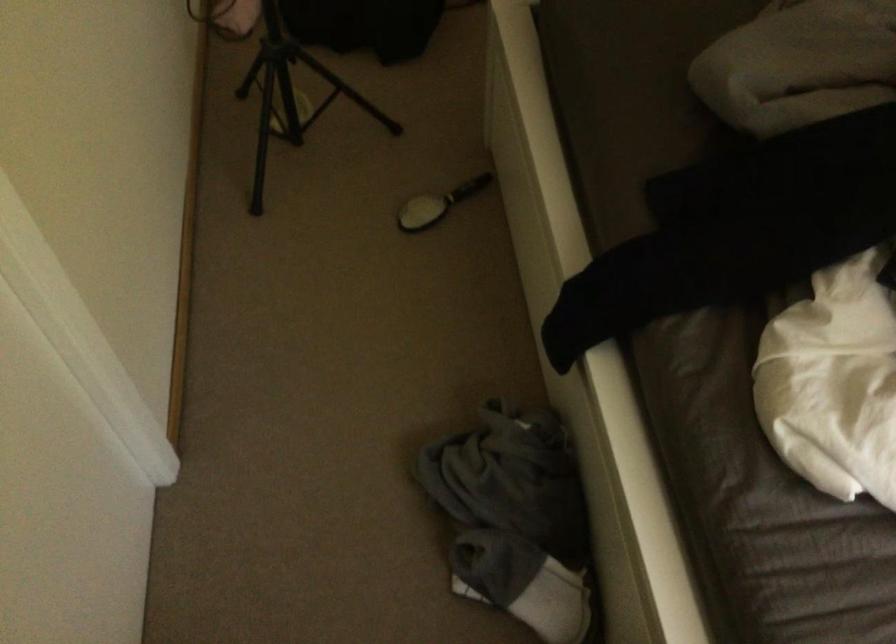
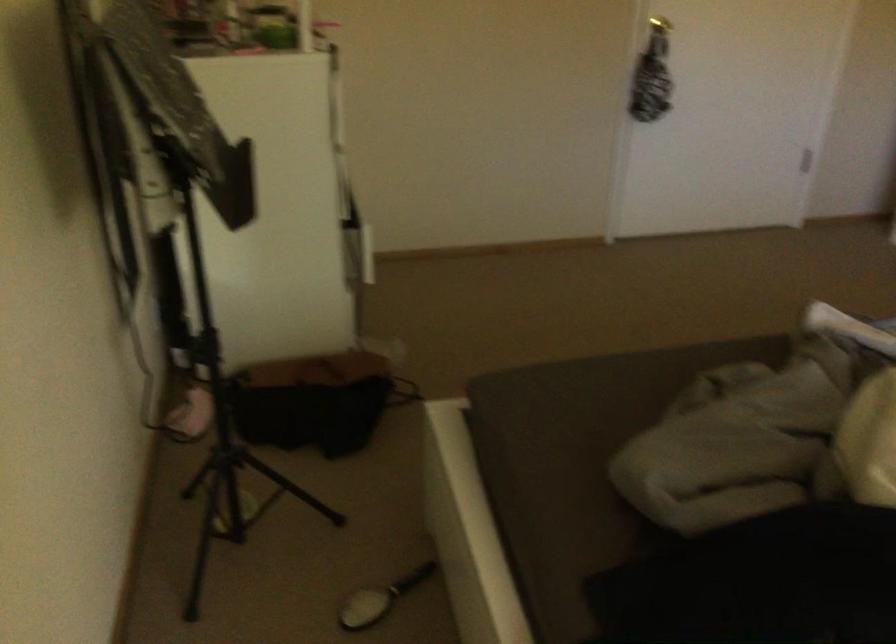
Question: Which direction would the cameraman need to move to produce the second image? Reply with the corresponding letter.

Choices:
 (A) Left
 (B) Right
 (C) Forward
 (D) Backward

Answer: (D)